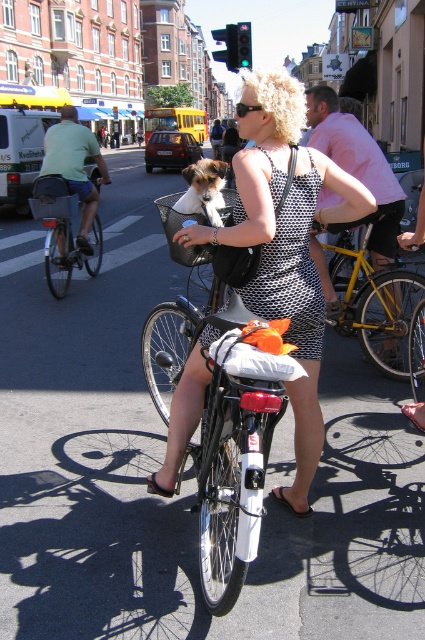
You are a delivery drone trying to navigate between two points in the scene. The first point is point (x=297, y=339) and the second is point (x=334, y=317). Which point should you aim for first if you want to follow the path from the front to the back of the scene?

You should aim for point (x=297, y=339) first because it is in front of point (x=334, y=317), so following the path from front to back would start with the first point.